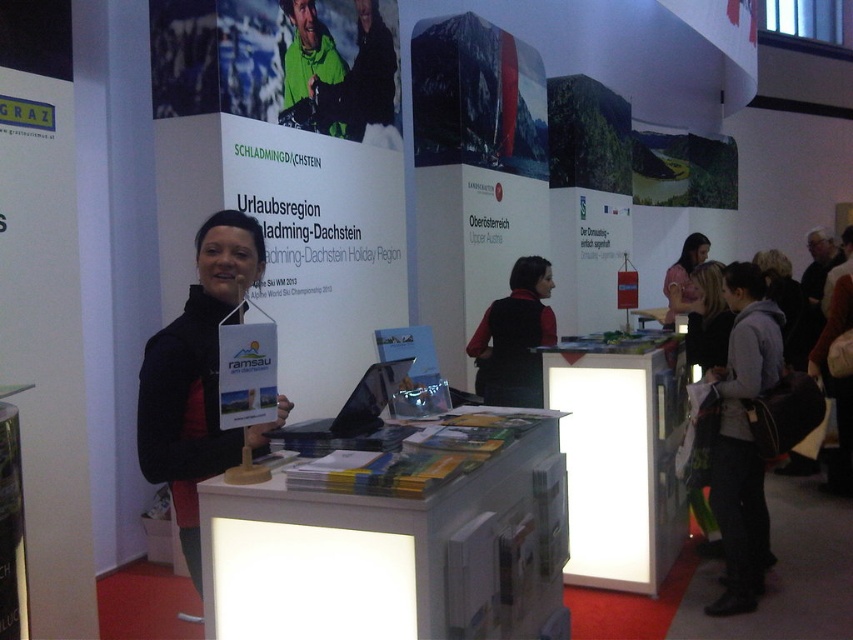
Question: Estimate the real-world distances between objects in this image. Which object is closer to the white plastic table at center?

Choices:
 (A) gray fleece jacket at lower right
 (B) black matte vest at center

Answer: (A)

Question: Can you confirm if white glossy information desk at center is thinner than black fabric at center?

Choices:
 (A) yes
 (B) no

Answer: (B)

Question: Which point appears farthest from the camera in this image?

Choices:
 (A) pyautogui.click(x=693, y=244)
 (B) pyautogui.click(x=390, y=362)

Answer: (A)

Question: Considering the relative positions of black fabric at center and dark gray suit at right in the image provided, where is black fabric at center located with respect to dark gray suit at right?

Choices:
 (A) left
 (B) right

Answer: (A)

Question: Does white plastic table at center appear over black fabric at center?

Choices:
 (A) no
 (B) yes

Answer: (A)

Question: Which of the following is the closest to the observer?

Choices:
 (A) (676, 296)
 (B) (398, 374)
 (C) (625, 429)
 (D) (547, 445)

Answer: (B)